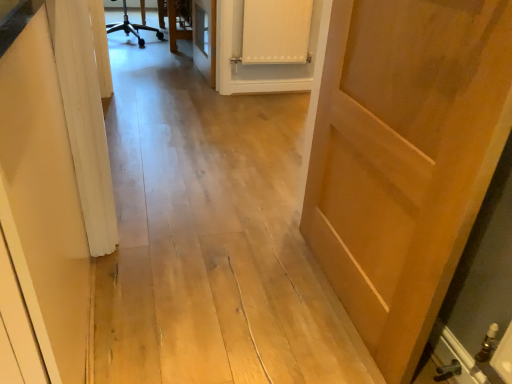
Question: Considering the positions of white matte cabinet at upper center and matte wood door at right in the image, is white matte cabinet at upper center bigger or smaller than matte wood door at right?

Choices:
 (A) small
 (B) big

Answer: (A)

Question: Is white matte cabinet at upper center to the left or to the right of matte wood door at right in the image?

Choices:
 (A) left
 (B) right

Answer: (A)

Question: Is point (251, 6) closer or farther from the camera than point (327, 213)?

Choices:
 (A) farther
 (B) closer

Answer: (A)

Question: Which is correct: matte wood door at right is inside white matte cabinet at upper center, or outside of it?

Choices:
 (A) outside
 (B) inside

Answer: (A)

Question: From a real-world perspective, is matte wood door at right physically located above or below white matte cabinet at upper center?

Choices:
 (A) below
 (B) above

Answer: (B)

Question: Considering the positions of point (309, 195) and point (274, 16), is point (309, 195) closer or farther from the camera than point (274, 16)?

Choices:
 (A) closer
 (B) farther

Answer: (A)

Question: Is matte wood door at right taller or shorter than white matte cabinet at upper center?

Choices:
 (A) tall
 (B) short

Answer: (A)